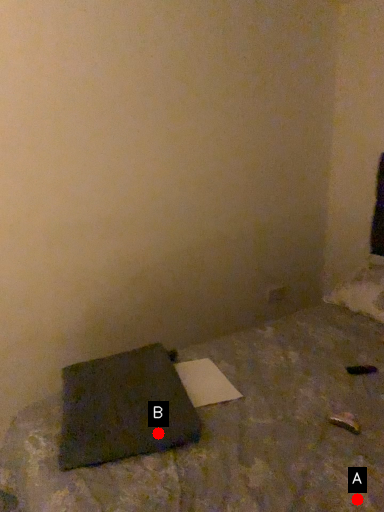
Question: Two points are circled on the image, labeled by A and B beside each circle. Which point is closer to the camera taking this photo?

Choices:
 (A) A is closer
 (B) B is closer

Answer: (A)